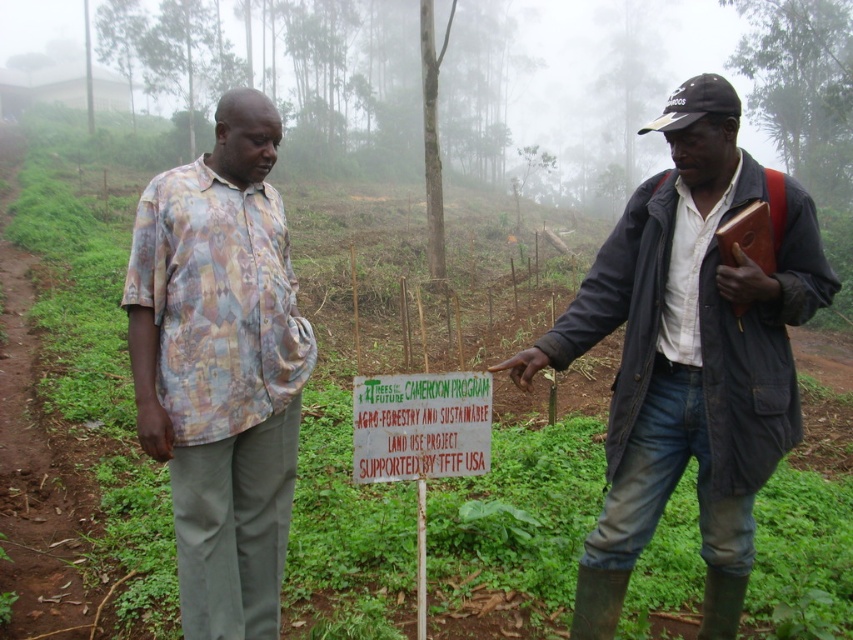
Question: Which object is positioned closest to the green wooden sign at center?

Choices:
 (A) printed fabric shirt at left
 (B) dark blue jacket at center

Answer: (B)

Question: Can you confirm if green painted wood sign at center is positioned to the right of green wooden sign at center?

Choices:
 (A) no
 (B) yes

Answer: (A)

Question: Which point is farther from the camera taking this photo?

Choices:
 (A) (231, 500)
 (B) (657, 310)
 (C) (370, 412)

Answer: (A)

Question: Which point is closer to the camera?

Choices:
 (A) dark blue jacket at center
 (B) printed fabric shirt at left

Answer: (A)

Question: Does dark blue jacket at center have a greater width compared to green wooden sign at center?

Choices:
 (A) no
 (B) yes

Answer: (B)

Question: Can you confirm if dark blue jacket at center is positioned to the left of green wooden sign at center?

Choices:
 (A) no
 (B) yes

Answer: (A)